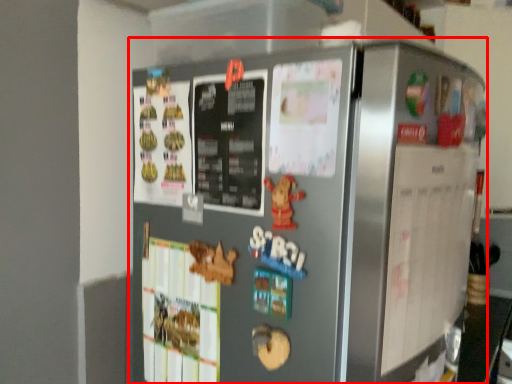
Question: Observing the image, what is the correct spatial positioning of refrigerator (annotated by the red box) in reference to bulletin board?

Choices:
 (A) right
 (B) left

Answer: (B)